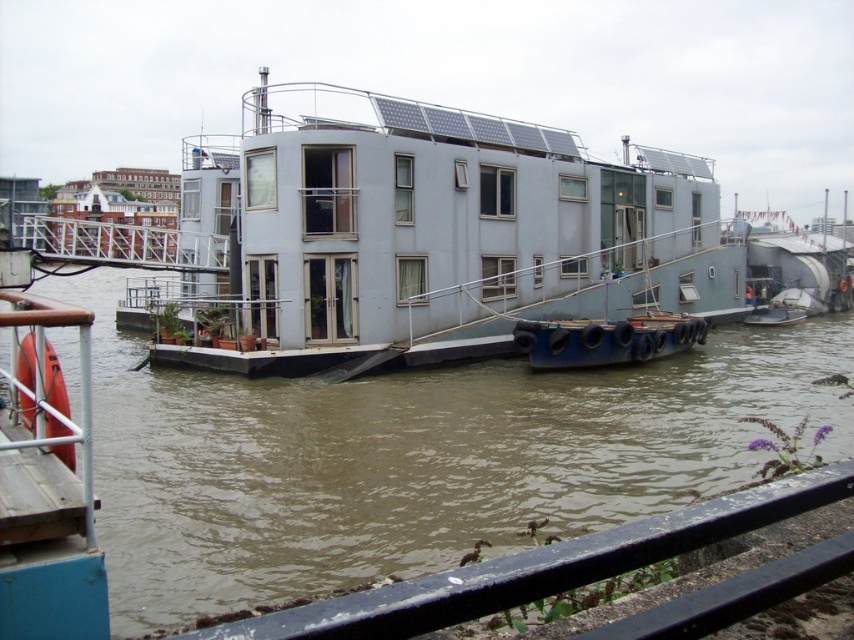
You are standing on the houseboat and want to check the water quality at a specific location. Which object in the scene corresponds to the coordinates point (410, 458)?

The coordinates point (410, 458) correspond to the brown murky water at center.

You are standing on the houseboat and want to place a new solar panel on the roof. The installation requires knowing which of the two points, point [279,461] or point [367,102], is closer to the camera to ensure proper alignment. Which point should you choose?

Point [279,461] is closer to the camera than point [367,102], so you should choose point [279,461] for proper alignment.

You are a delivery person trying to navigate a narrow canal between two buildings. You see the brown murky water at center and the light gray concrete houseboat at center. Which one has a smaller width?

The brown murky water at center has a smaller width than the light gray concrete houseboat at center.